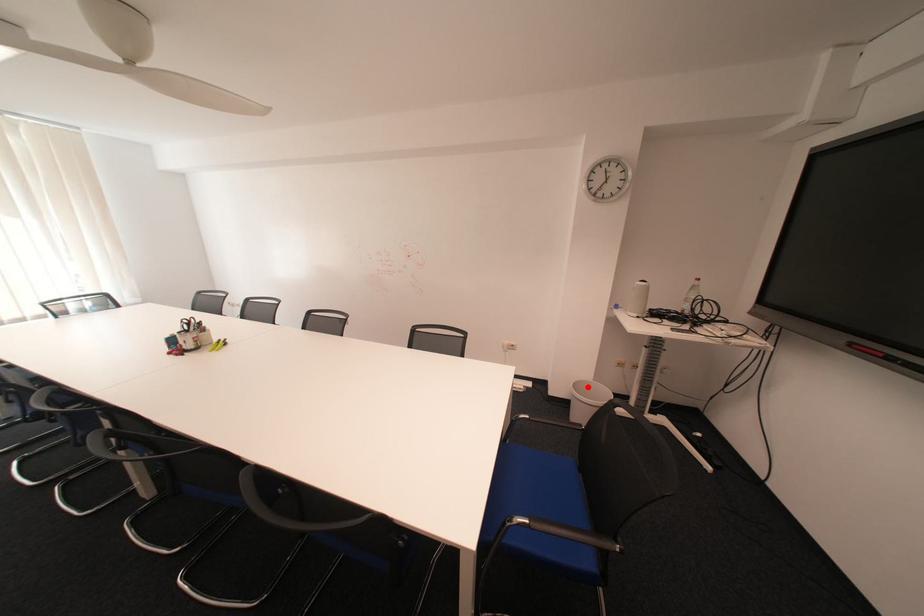
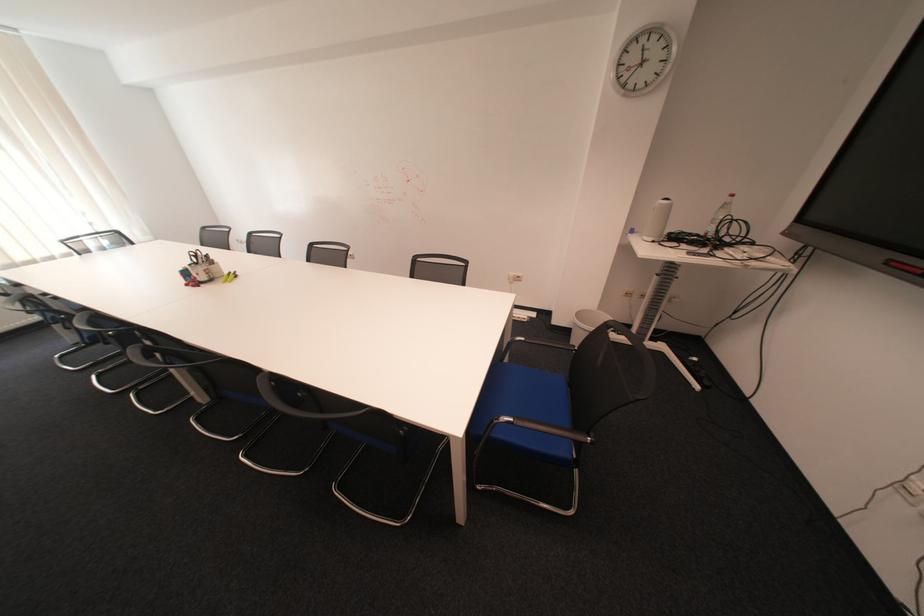
Question: I am providing you with two images of the same scene from different viewpoints. Given a red point in image1, look at the same physical point in image2. Is it:

Choices:
 (A) Closer to the viewpoint
 (B) Farther from the viewpoint

Answer: (A)